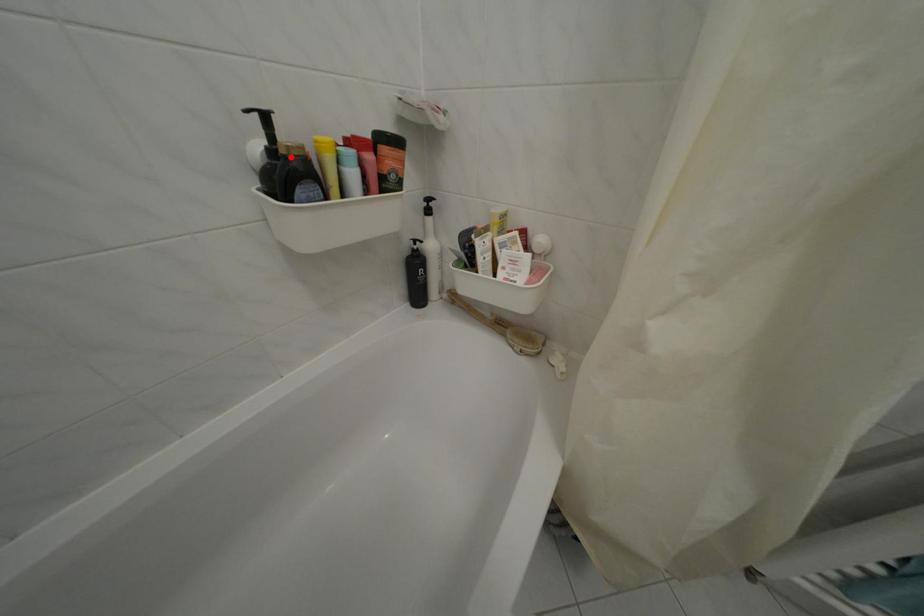
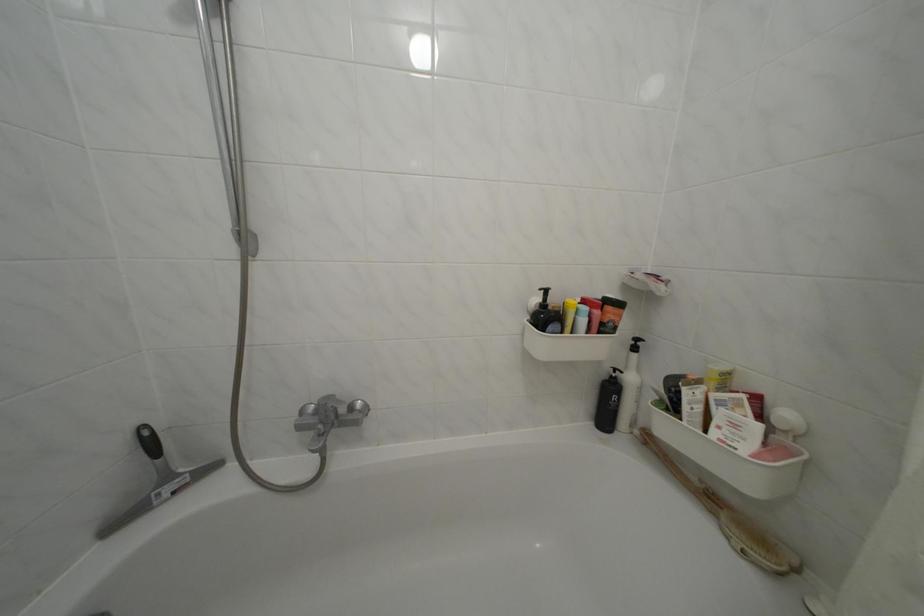
Where in the second image is the point corresponding to the highlighted location from the first image?

(560, 314)